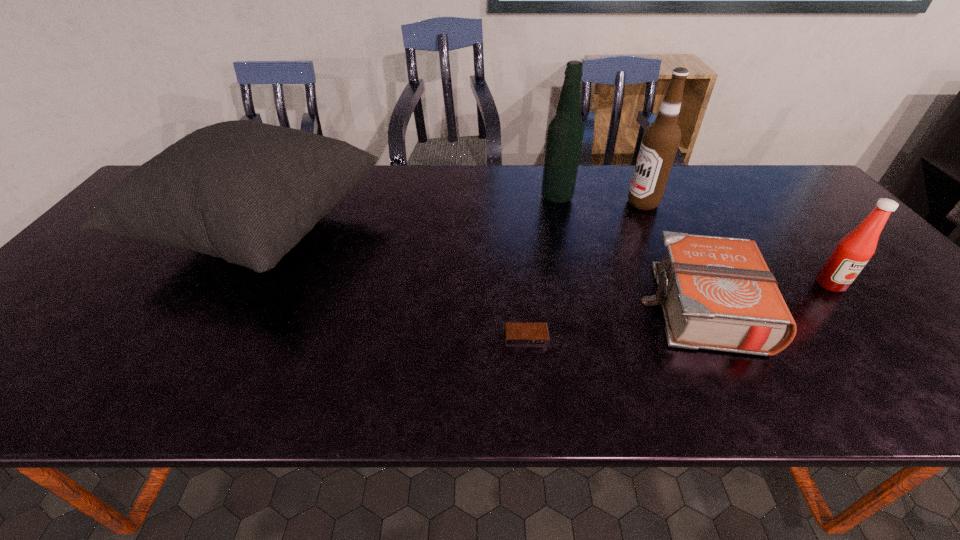
Image resolution: width=960 pixels, height=540 pixels. Identify the location of the third object from left to right. (565, 133).

Where is `the right alcohol`? the right alcohol is located at coordinates (661, 139).

Identify the location of the leftmost object. (248, 192).

At what (x,y) coordinates should I click in order to perform the action: click on cushion. Please return your answer as a coordinate pair (x, y). The image size is (960, 540). Looking at the image, I should click on (248, 192).

Find the location of a particular element. condiment is located at coordinates (853, 251).

Find the location of a particular element. the rightmost object is located at coordinates (853, 251).

At what (x,y) coordinates should I click in order to perform the action: click on the fifth tallest object. Please return your answer as a coordinate pair (x, y). The height and width of the screenshot is (540, 960). Looking at the image, I should click on (717, 293).

Locate an element on the screen. This screenshot has height=540, width=960. the second object from left to right is located at coordinates (516, 334).

In order to click on alarm clock in this screenshot , I will do `click(516, 334)`.

Where is `free spot located on the right of the third object from left to right`? The width and height of the screenshot is (960, 540). free spot located on the right of the third object from left to right is located at coordinates (633, 198).